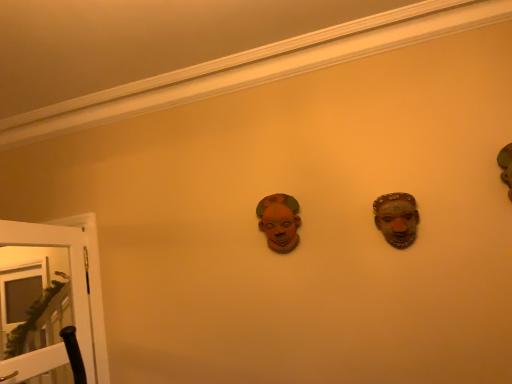
This screenshot has height=384, width=512. Find the location of `matte brown mask at center`. matte brown mask at center is located at coordinates (279, 221).

Measure the distance between matte brown mask at center and camera.

2.12 meters.

This screenshot has height=384, width=512. What do you see at coordinates (279, 221) in the screenshot?
I see `matte brown mask at center` at bounding box center [279, 221].

This screenshot has height=384, width=512. What are the coordinates of `white glossy door at lower left` in the screenshot? It's located at (42, 300).

What do you see at coordinates (42, 300) in the screenshot?
I see `white glossy door at lower left` at bounding box center [42, 300].

The image size is (512, 384). In order to click on matte brown mask at center in this screenshot , I will do `click(279, 221)`.

Which is more to the right, matte brown mask at center or white glossy door at lower left?

From the viewer's perspective, matte brown mask at center appears more on the right side.

Which is behind, matte brown mask at center or white glossy door at lower left?

matte brown mask at center is further from the camera.

Considering the points (257, 208) and (44, 285), which point is behind, point (257, 208) or point (44, 285)?

The point (44, 285) is farther from the camera.

From the picture: From the image's perspective, between matte brown mask at center and white glossy door at lower left, which one is located above?

matte brown mask at center, from the image's perspective.

From a real-world perspective, does matte brown mask at center stand above white glossy door at lower left?

Indeed, from a real-world perspective, matte brown mask at center stands above white glossy door at lower left.

Which object is wider, matte brown mask at center or white glossy door at lower left?

white glossy door at lower left.

Can you confirm if matte brown mask at center is shorter than white glossy door at lower left?

Yes, matte brown mask at center is shorter than white glossy door at lower left.

From the picture: Considering the relative sizes of matte brown mask at center and white glossy door at lower left in the image provided, is matte brown mask at center bigger than white glossy door at lower left?

Actually, matte brown mask at center might be smaller than white glossy door at lower left.

Is matte brown mask at center inside or outside of white glossy door at lower left?

matte brown mask at center is outside white glossy door at lower left.

Is matte brown mask at center with white glossy door at lower left?

They are not placed beside each other.

Is matte brown mask at center facing towards white glossy door at lower left?

No, matte brown mask at center is not aimed at white glossy door at lower left.

Locate an element on the screen. The height and width of the screenshot is (384, 512). person above the white glossy door at lower left (from the image's perspective) is located at coordinates (279, 221).

Does white glossy door at lower left appear on the right side of matte brown mask at center?

In fact, white glossy door at lower left is to the left of matte brown mask at center.

Considering the positions of objects white glossy door at lower left and matte brown mask at center in the image provided, who is behind, white glossy door at lower left or matte brown mask at center?

matte brown mask at center is behind.

Which is in front, point (91, 358) or point (273, 204)?

Positioned in front is point (273, 204).

From the image's perspective, between white glossy door at lower left and matte brown mask at center, who is located below?

From the image's view, white glossy door at lower left is below.

From a real-world perspective, is white glossy door at lower left over matte brown mask at center?

No, from a real-world perspective, white glossy door at lower left is not over matte brown mask at center

Can you confirm if white glossy door at lower left is wider than matte brown mask at center?

Yes.

Based on the photo, does white glossy door at lower left have a lesser height compared to matte brown mask at center?

No, white glossy door at lower left is not shorter than matte brown mask at center.

Considering the sizes of objects white glossy door at lower left and matte brown mask at center in the image provided, who is smaller, white glossy door at lower left or matte brown mask at center?

matte brown mask at center is smaller.

Is white glossy door at lower left located outside matte brown mask at center?

Yes.

Would you consider white glossy door at lower left to be distant from matte brown mask at center?

Yes.

Could you tell me if white glossy door at lower left is turned towards matte brown mask at center?

No, white glossy door at lower left is not facing towards matte brown mask at center.

Can you tell me how much white glossy door at lower left and matte brown mask at center differ in facing direction?

There is a 85.7-degree angle between the facing directions of white glossy door at lower left and matte brown mask at center.

Locate an element on the screen. The image size is (512, 384). door lying on the left of matte brown mask at center is located at coordinates pos(42,300).

Locate an element on the screen. person that appears on the right of white glossy door at lower left is located at coordinates (279, 221).

The image size is (512, 384). I want to click on person above the white glossy door at lower left (from a real-world perspective), so click(279, 221).